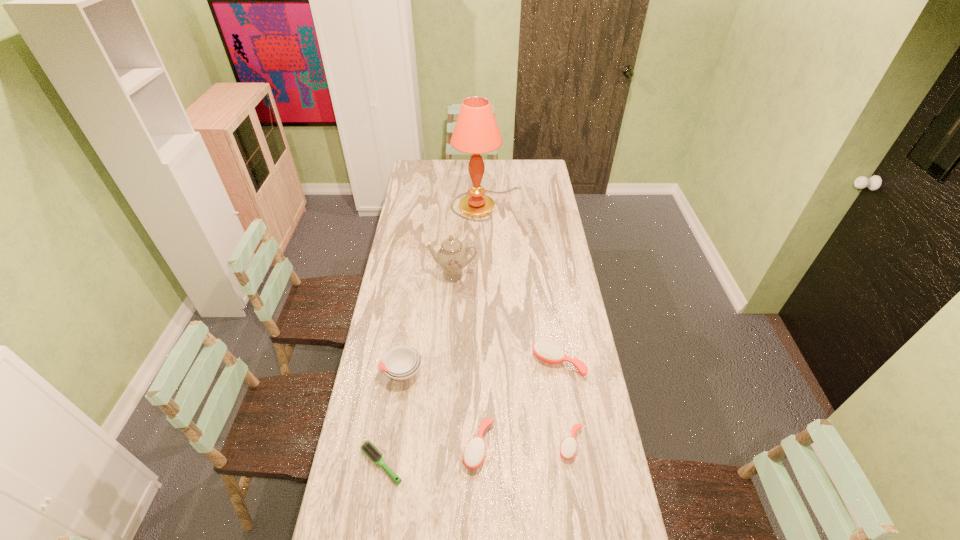
Locate an element on the screen. Image resolution: width=960 pixels, height=540 pixels. light hairbrush is located at coordinates (367, 448).

The width and height of the screenshot is (960, 540). What are the coordinates of `the leftmost hairbrush` in the screenshot? It's located at (367, 448).

Where is `free space located on the back of the lamp`? free space located on the back of the lamp is located at coordinates (487, 165).

At what (x,y) coordinates should I click in order to perform the action: click on free space located 0.060m on the spout of the chinaware. Please return your answer as a coordinate pair (x, y). The image size is (960, 540). Looking at the image, I should click on (451, 295).

This screenshot has width=960, height=540. I want to click on vacant space situated 0.100m on the back of the white soup bowl, so tap(408, 335).

Locate an element on the screen. The height and width of the screenshot is (540, 960). blank space located on the back of the biggest orange hairbrush is located at coordinates (548, 298).

Where is `free space located 0.180m on the back of the fifth tallest object`? free space located 0.180m on the back of the fifth tallest object is located at coordinates (479, 377).

Where is `vacant space located on the front of the smallest orange hairbrush`? Image resolution: width=960 pixels, height=540 pixels. vacant space located on the front of the smallest orange hairbrush is located at coordinates (584, 527).

At what (x,y) coordinates should I click in order to perform the action: click on free location located 0.140m on the back of the shortest object. Please return your answer as a coordinate pair (x, y). This screenshot has height=540, width=960. Looking at the image, I should click on (391, 405).

This screenshot has width=960, height=540. What are the coordinates of `soup bowl that is at the left edge` in the screenshot? It's located at (401, 363).